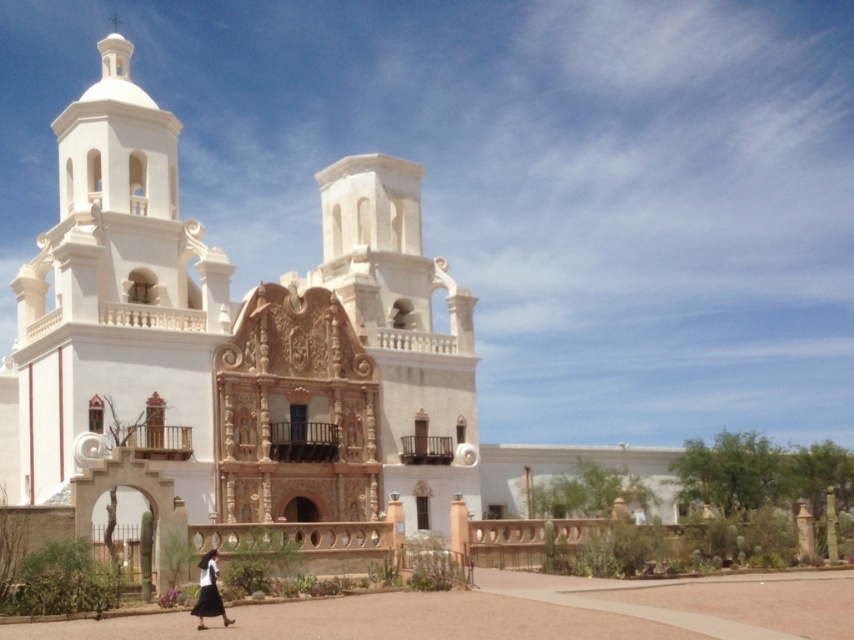
You are standing in front of the white stucco church at center and want to take a photo of the white cotton dress at lower center. Which object should you point your camera towards first?

You should point your camera towards the white cotton dress at lower center first because it is located below the white stucco church at center, making it closer to the camera from the observer perspective.

You are a photographer planning to take a picture of the white stucco church at center and the white cotton dress at lower center. Since both are white, you want to ensure they are distinguishable in the photo. What visual cue could you use to differentiate them based on their size?

The white stucco church at center is larger in size compared to the white cotton dress at lower center, so the church will appear bigger in the photo, making them distinguishable.